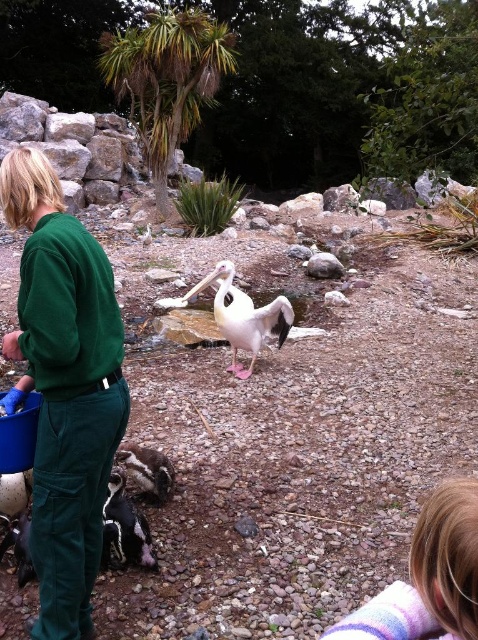
Question: Which point is farther from the camera taking this photo?

Choices:
 (A) (269, 310)
 (B) (144, 484)
 (C) (143, 516)

Answer: (A)

Question: Considering the relative positions of black glossy penguin at lower left and black and white speckled bird at lower left in the image provided, where is black glossy penguin at lower left located with respect to black and white speckled bird at lower left?

Choices:
 (A) above
 (B) below

Answer: (B)

Question: Can you confirm if blonde hair at lower right is smaller than black glossy penguin at lower left?

Choices:
 (A) no
 (B) yes

Answer: (B)

Question: Among these objects, which one is nearest to the camera?

Choices:
 (A) black and white speckled bird at lower left
 (B) black glossy penguin at lower left
 (C) white matte pelican at center

Answer: (B)

Question: Which of the following is the farthest from the observer?

Choices:
 (A) white matte pelican at center
 (B) black glossy penguin at lower left

Answer: (A)

Question: Is black glossy penguin at lower left to the right of black and white speckled bird at lower left from the viewer's perspective?

Choices:
 (A) no
 (B) yes

Answer: (B)